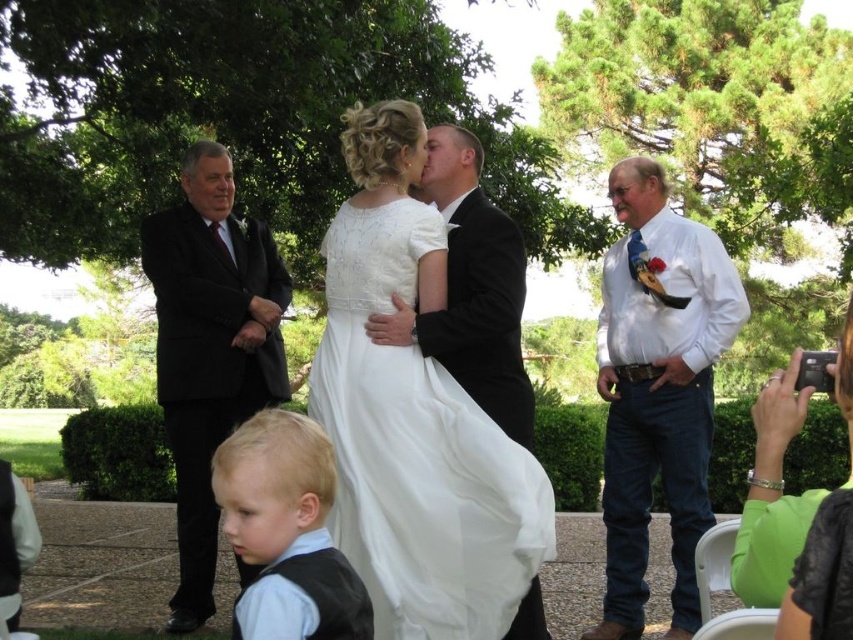
You are a GUI agent. You are given a task and a screenshot of the screen. Output one action in this format:
    pyautogui.click(x=<x>, y=<y>)
    Task: Click on the black suit at left
    
    Given the screenshot: What is the action you would take?
    pyautogui.click(x=210, y=348)

Is black suit at left thinner than green fabric flower girl at lower right?

No.

The width and height of the screenshot is (853, 640). Describe the element at coordinates (210, 348) in the screenshot. I see `black suit at left` at that location.

What are the coordinates of `black suit at left` in the screenshot? It's located at (210, 348).

In the scene shown: Can you confirm if satin/sheer white dress at center is taller than blonde hair vest at lower left?

Yes, satin/sheer white dress at center is taller than blonde hair vest at lower left.

Is point (426, 220) less distant than point (305, 492)?

No, (426, 220) is behind (305, 492).

Is point (476, 444) more distant than point (270, 605)?

Yes, it is.

This screenshot has width=853, height=640. What are the coordinates of `satin/sheer white dress at center` in the screenshot? It's located at (418, 452).

Is black suit at left in front of blonde hair vest at lower left?

No, it is behind blonde hair vest at lower left.

Is black suit at left shorter than blonde hair vest at lower left?

Incorrect, black suit at left's height does not fall short of blonde hair vest at lower left's.

I want to click on black suit at left, so click(210, 348).

Locate an element on the screen. black suit at left is located at coordinates (210, 348).